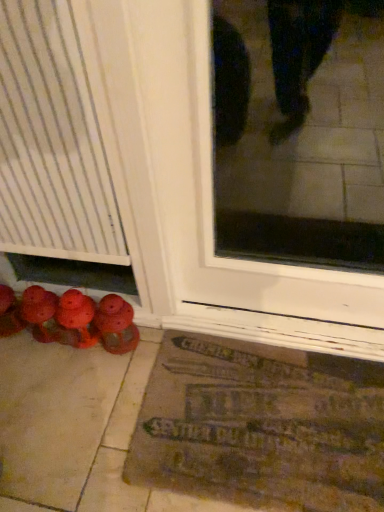
Question: From the image's perspective, is brown textured mat at lower center over matte red shoes at lower left, positioned as the 2th footwear in left-to-right order?

Choices:
 (A) no
 (B) yes

Answer: (A)

Question: Could you tell me if brown textured mat at lower center is facing matte red shoes at lower left, positioned as the first footwear in right-to-left order?

Choices:
 (A) no
 (B) yes

Answer: (A)

Question: Is brown textured mat at lower center bigger than matte red shoes at lower left, positioned as the first footwear in right-to-left order?

Choices:
 (A) no
 (B) yes

Answer: (B)

Question: Does brown textured mat at lower center contain matte red shoes at lower left, positioned as the 2th footwear in left-to-right order?

Choices:
 (A) no
 (B) yes

Answer: (A)

Question: Is brown textured mat at lower center at the left side of matte red shoes at lower left, positioned as the 2th footwear in left-to-right order?

Choices:
 (A) yes
 (B) no

Answer: (B)

Question: In the image, is matte red shoes at lower left, which appears as the 1th footwear when viewed from the left, positioned in front of or behind matte red shoes at lower left, positioned as the 2th footwear in left-to-right order?

Choices:
 (A) front
 (B) behind

Answer: (B)

Question: Is point (3, 287) positioned closer to the camera than point (127, 325)?

Choices:
 (A) closer
 (B) farther

Answer: (B)

Question: Is matte red shoes at lower left, which appears as the 1th footwear when viewed from the left, wider or thinner than matte red shoes at lower left, positioned as the 2th footwear in left-to-right order?

Choices:
 (A) wide
 (B) thin

Answer: (B)

Question: From the image's perspective, is matte red shoes at lower left, which is counted as the second footwear, starting from the right, above or below matte red shoes at lower left, positioned as the 2th footwear in left-to-right order?

Choices:
 (A) below
 (B) above

Answer: (B)

Question: Looking at their shapes, would you say matte red shoes at lower left, positioned as the first footwear in right-to-left order, is wider or thinner than brown textured mat at lower center?

Choices:
 (A) wide
 (B) thin

Answer: (B)

Question: Is matte red shoes at lower left, positioned as the 2th footwear in left-to-right order, taller or shorter than brown textured mat at lower center?

Choices:
 (A) tall
 (B) short

Answer: (A)

Question: Is matte red shoes at lower left, positioned as the 2th footwear in left-to-right order, in front of or behind brown textured mat at lower center in the image?

Choices:
 (A) front
 (B) behind

Answer: (B)

Question: Is matte red shoes at lower left, positioned as the first footwear in right-to-left order, inside or outside of brown textured mat at lower center?

Choices:
 (A) inside
 (B) outside

Answer: (B)

Question: From the image's perspective, is brown textured mat at lower center above or below matte red shoes at lower left, which is counted as the second footwear, starting from the right?

Choices:
 (A) above
 (B) below

Answer: (B)

Question: From a real-world perspective, relative to matte red shoes at lower left, which appears as the 1th footwear when viewed from the left, is brown textured mat at lower center vertically above or below?

Choices:
 (A) below
 (B) above

Answer: (A)